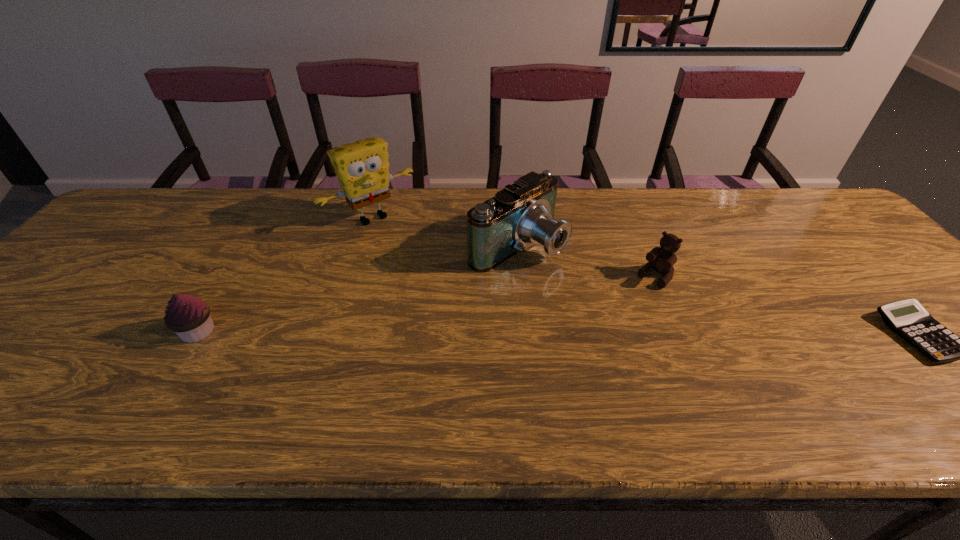
At what (x,y) coordinates should I click in order to perform the action: click on cupcake. Please return your answer as a coordinate pair (x, y). Looking at the image, I should click on (189, 317).

At what (x,y) coordinates should I click in order to perform the action: click on the fourth object from left to right. Please return your answer as a coordinate pair (x, y). Looking at the image, I should click on (661, 259).

This screenshot has width=960, height=540. I want to click on the tallest object, so click(x=362, y=167).

The width and height of the screenshot is (960, 540). I want to click on the fourth object from right to left, so click(362, 167).

This screenshot has width=960, height=540. Identify the location of the second tallest object. tap(522, 213).

Locate an element on the screen. The image size is (960, 540). camcorder is located at coordinates (522, 213).

Where is `vacant region located on the back of the cupcake`? vacant region located on the back of the cupcake is located at coordinates (225, 287).

Locate an element on the screen. vacant region located 0.210m on the face of the fourth object from left to right is located at coordinates click(600, 333).

This screenshot has width=960, height=540. I want to click on vacant space located 0.350m on the face of the fourth object from left to right, so click(x=563, y=370).

At what (x,y) coordinates should I click in order to perform the action: click on free space located on the face of the fourth object from left to right. Please return your answer as a coordinate pair (x, y). The image size is (960, 540). Looking at the image, I should click on (551, 382).